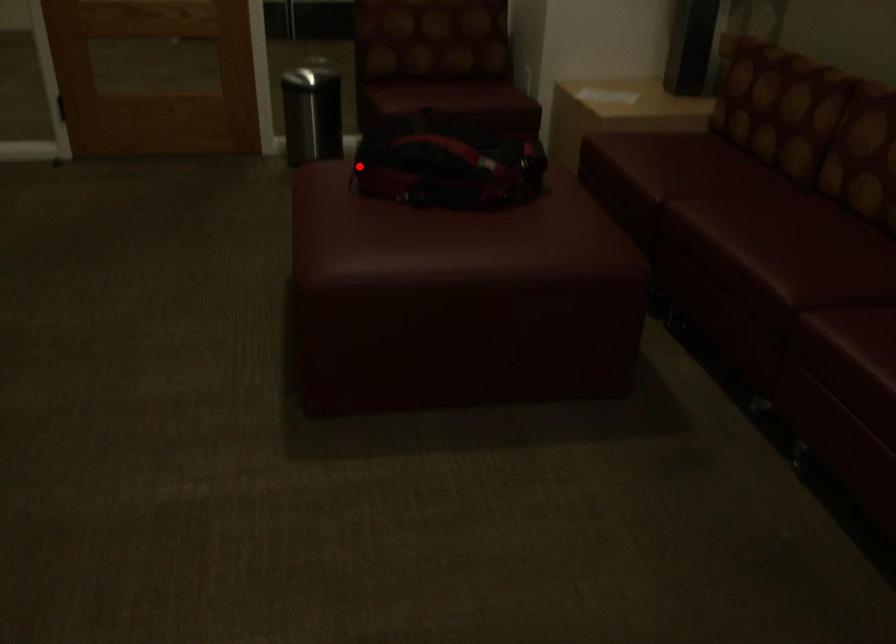
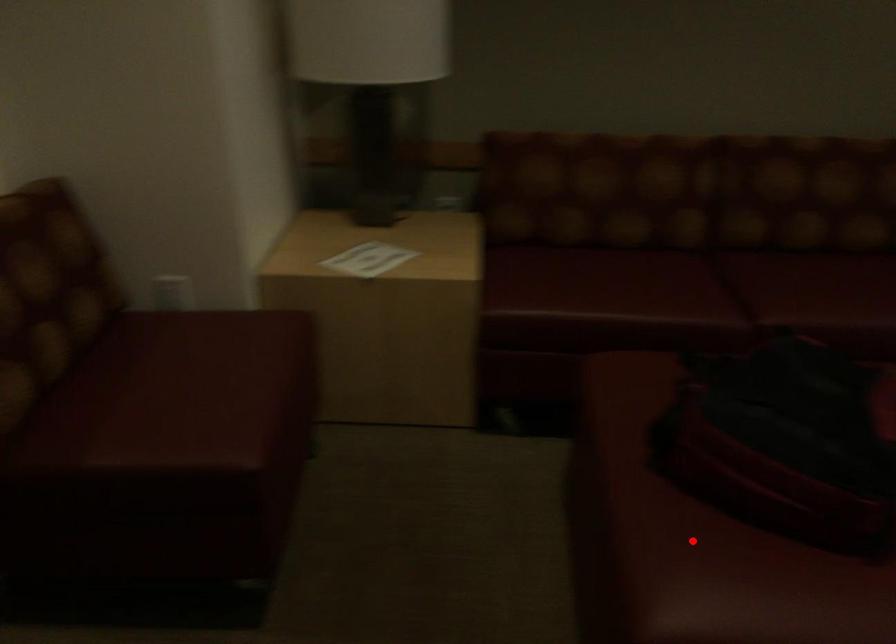
I am providing you with two images of the same scene from different viewpoints. A red point is marked on the first image and another point is marked on the second image. Is the red point in image1 aligned with the point shown in image2?

Yes